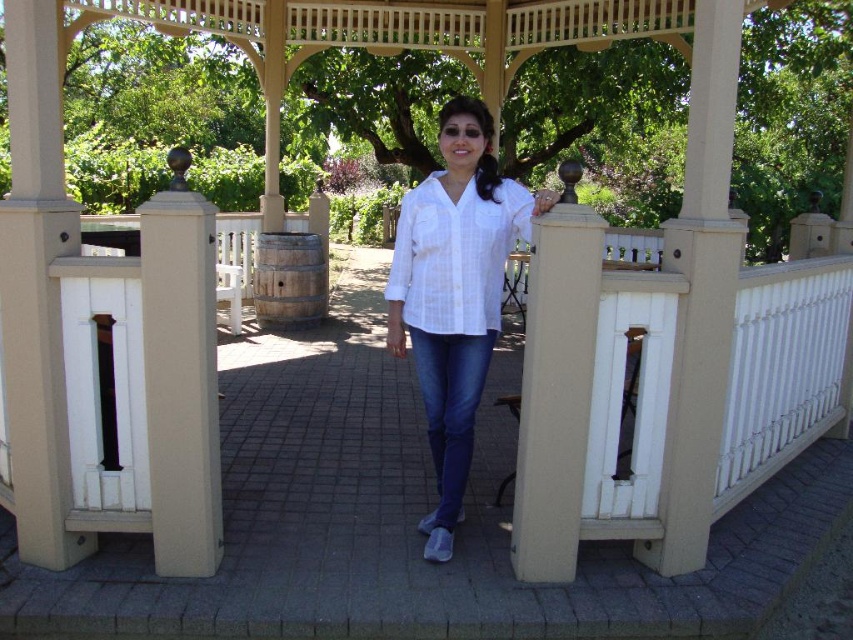
You are a photographer trying to capture the white woven blouse at center and the beige concrete post at center in a single shot. Based on their positions, which object is closer to the camera?

The white woven blouse at center is closer to the camera because the beige concrete post at center is behind it.

You are standing at the point labeled as point (560,356) in the gazebo area. You want to walk to the point labeled as point (427,531). Which direction should you move relative to your current position?

You should move forward because point (427,531) is behind point (560,356), meaning it is in the direction you are facing if you are at point (560,356).